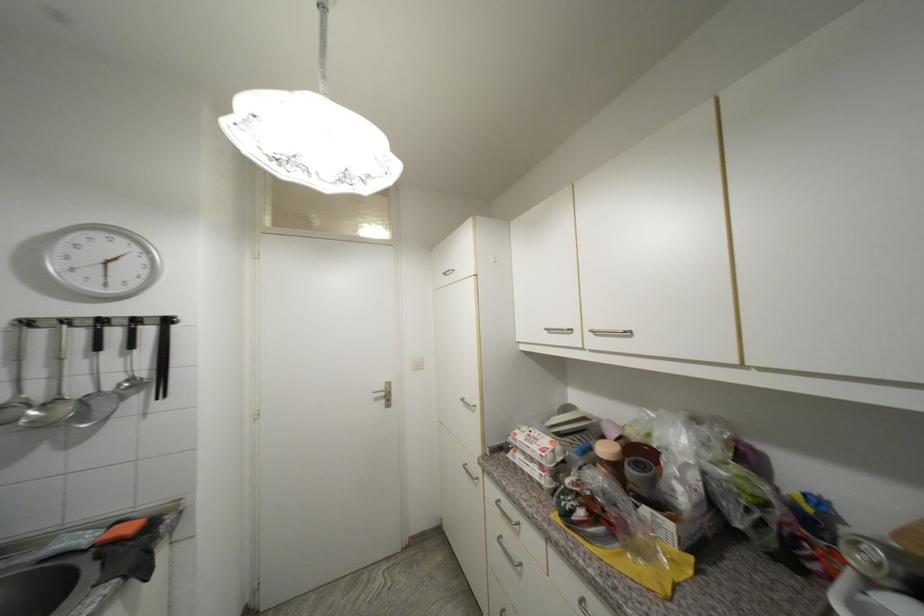
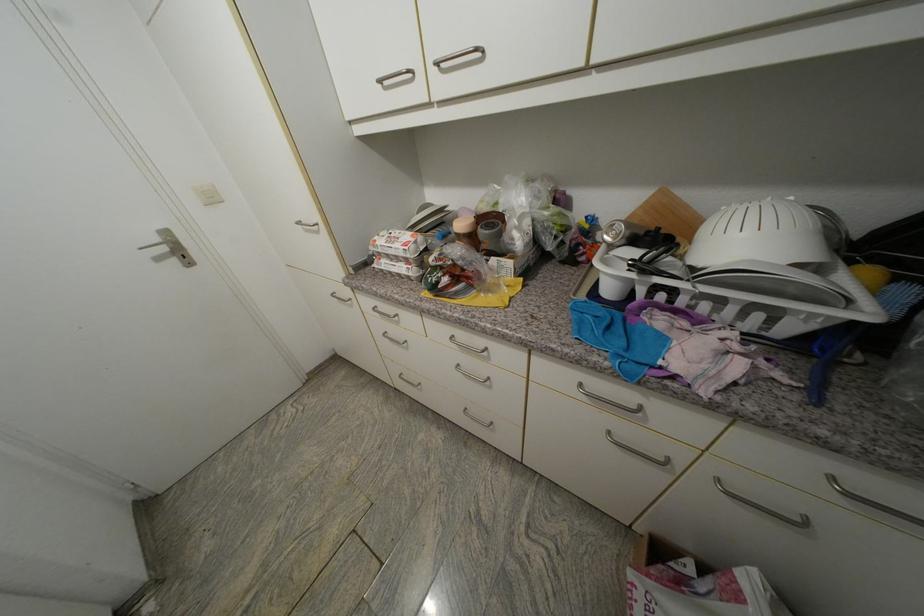
The first image is from the beginning of the video and the second image is from the end. How did the camera likely rotate when shooting the video?

The rotation direction of the camera is right-down.